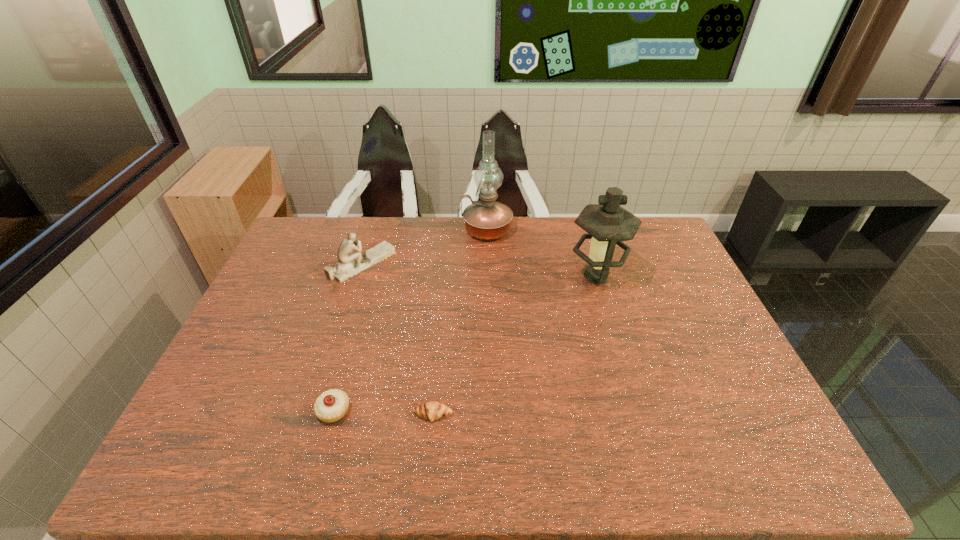
Where is `unoccupied position between the fourth tallest object and the left oil lamp`? The width and height of the screenshot is (960, 540). unoccupied position between the fourth tallest object and the left oil lamp is located at coordinates (410, 320).

Identify the location of vacant point located between the rightmost object and the figurine. (479, 270).

The height and width of the screenshot is (540, 960). I want to click on object that is the second nearest to the figurine, so click(331, 406).

The image size is (960, 540). I want to click on the fourth closest object to the figurine, so [x=607, y=223].

What are the coordinates of `vacant region that satisfies the following two spatial constraints: 1. on the back side of the fourth shortest object; 2. on the front-facing side of the third tallest object` in the screenshot? It's located at (592, 264).

You are a GUI agent. You are given a task and a screenshot of the screen. Output one action in this format:
    pyautogui.click(x=<x>, y=<y>)
    Task: Click on the free spot that satisfies the following two spatial constraints: 1. on the front-facing side of the taller pastry; 2. on the left side of the figurine
    
    Given the screenshot: What is the action you would take?
    (316, 411)

In order to click on free location that satisfies the following two spatial constraints: 1. on the front-facing side of the right oil lamp; 2. on the right side of the figurine in this screenshot , I will do `click(358, 276)`.

I want to click on free spot that satisfies the following two spatial constraints: 1. on the front side of the taller oil lamp; 2. on the front-facing side of the figurine, so click(488, 264).

The image size is (960, 540). In order to click on vacant space that satisfies the following two spatial constraints: 1. on the back side of the left pastry; 2. on the right side of the left oil lamp in this screenshot , I will do `click(385, 230)`.

This screenshot has height=540, width=960. Find the location of `vacant space that satisfies the following two spatial constraints: 1. on the front side of the left oil lamp; 2. on the right side of the nearer oil lamp`. vacant space that satisfies the following two spatial constraints: 1. on the front side of the left oil lamp; 2. on the right side of the nearer oil lamp is located at coordinates (488, 276).